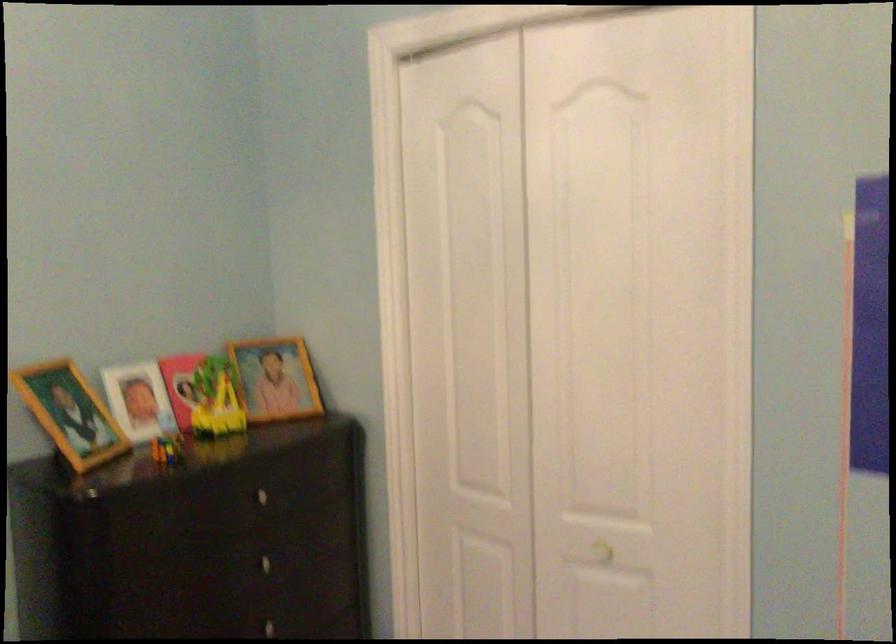
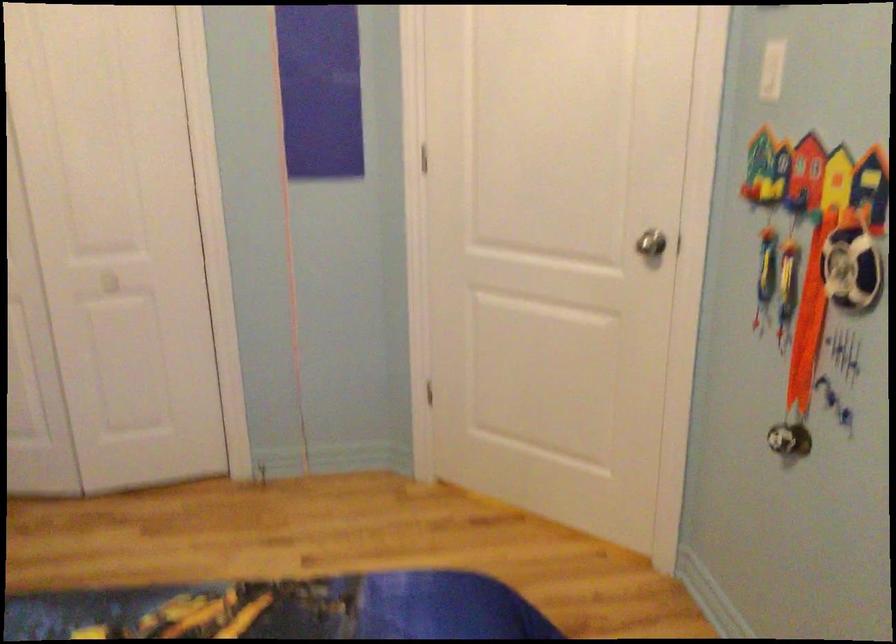
Question: The first image is from the beginning of the video and the second image is from the end. How did the camera likely rotate when shooting the video?

Choices:
 (A) Left
 (B) Right
 (C) Up
 (D) Down

Answer: (B)